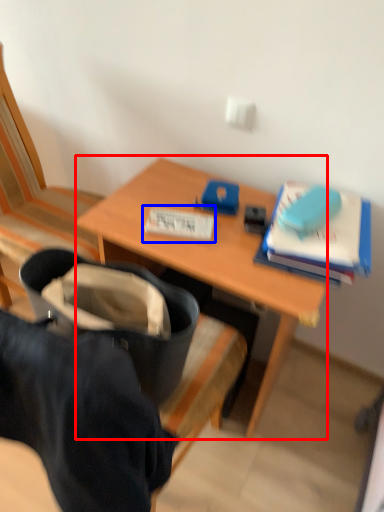
Question: Which object is further to the camera taking this photo, desk (highlighted by a red box) or paperback book (highlighted by a blue box)?

Choices:
 (A) desk
 (B) paperback book

Answer: (B)